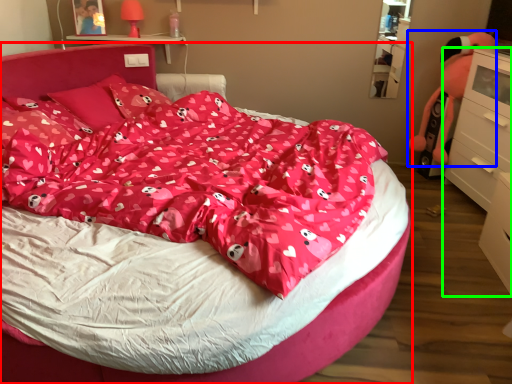
Question: Which is farther away from bed (highlighted by a red box)? toy (highlighted by a blue box) or chest of drawers (highlighted by a green box)?

Choices:
 (A) toy
 (B) chest of drawers

Answer: (A)